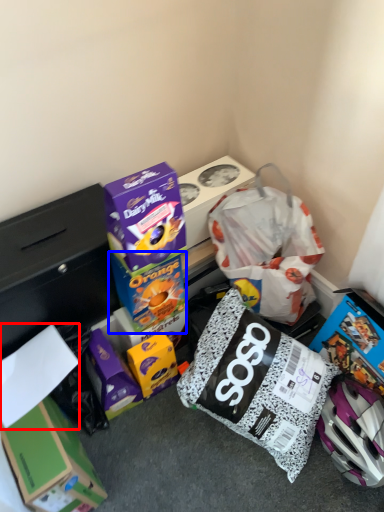
Question: Which object appears closest to the camera in this image, paper (highlighted by a red box) or box (highlighted by a blue box)?

Choices:
 (A) paper
 (B) box

Answer: (A)